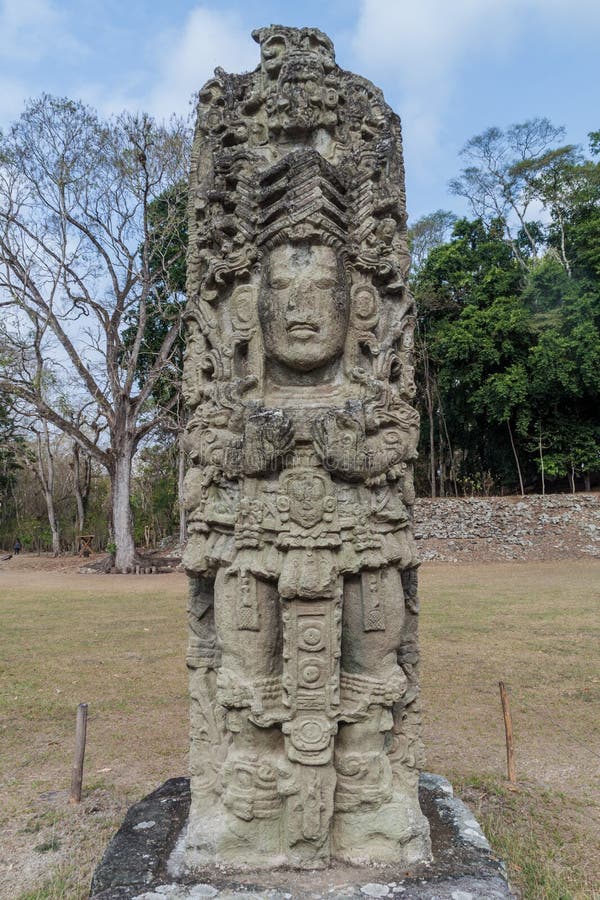
Find the location of `statue leg`. statue leg is located at coordinates (373, 648), (361, 733), (248, 736), (247, 650).